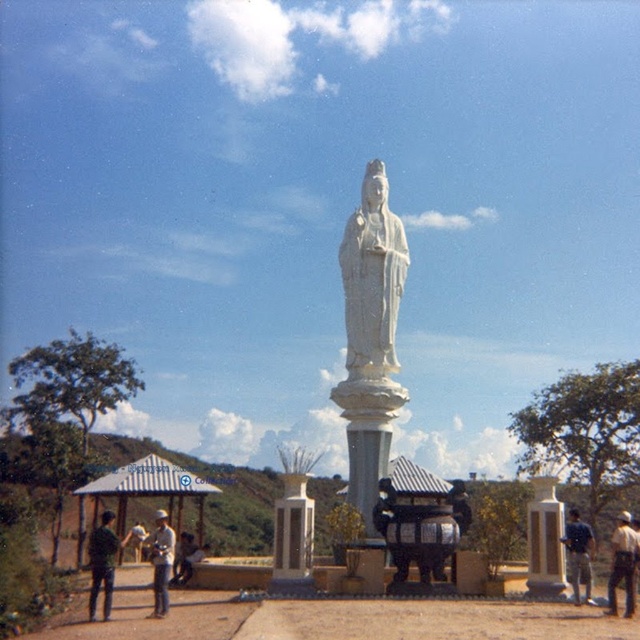
You are a photographer trying to capture a photo of the white stone statue at center and the green matte shirt at lower left in the same frame. Based on their positions, which object is located to the right of the other?

The white stone statue at center is positioned on the right side of green matte shirt at lower left.

You are an architect designing a new garden layout and need to place a new bench. The bench must be placed closer to the smaller object between the white marble column at center and the white stone statue at center. Which object should the bench be placed near?

The bench should be placed near the white marble column at center because it is smaller than the white stone statue at center according to the description.